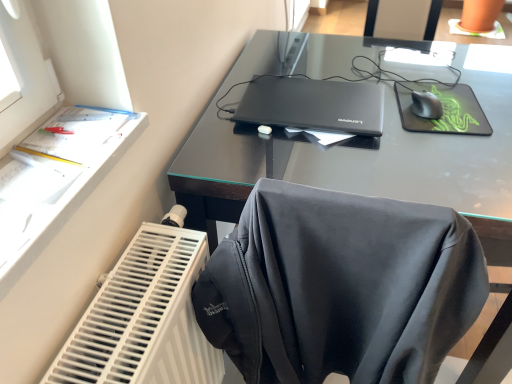
Locate an element on the screen. vacant location behind black matte laptop at center is located at coordinates (305, 58).